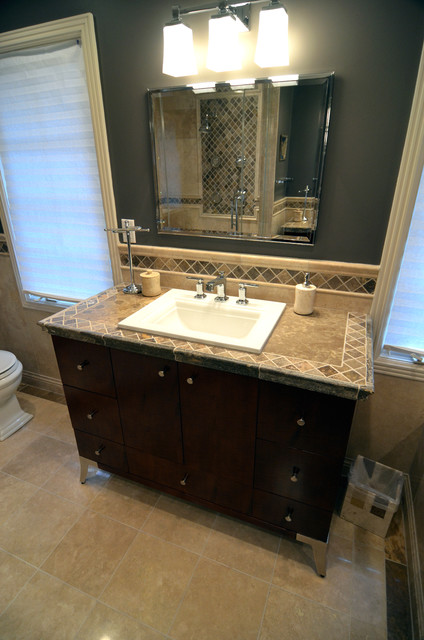
I want to click on faucet, so click(215, 281).